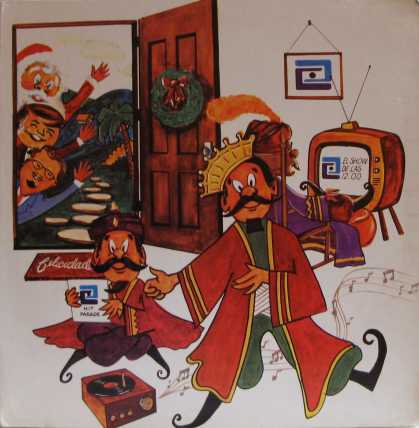
Where is `rounded square tv`? rounded square tv is located at coordinates (376, 156).